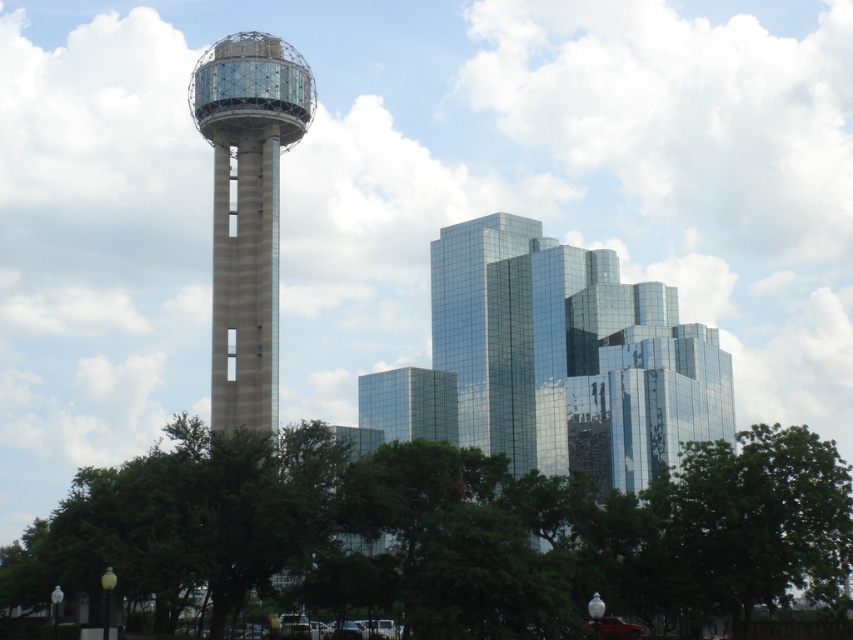
Question: Is green leafy tree at lower center above glassy reflective skyscraper at center?

Choices:
 (A) no
 (B) yes

Answer: (A)

Question: Can you confirm if green leafy tree at lower center is thinner than glassy reflective skyscraper at center?

Choices:
 (A) yes
 (B) no

Answer: (B)

Question: Which object is closer to the camera taking this photo?

Choices:
 (A) green leafy tree at lower center
 (B) glassy reflective skyscraper at center
 (C) concrete glass tower at center

Answer: (A)

Question: Among these points, which one is farthest from the camera?

Choices:
 (A) (265, 204)
 (B) (538, 632)

Answer: (A)

Question: Does green leafy tree at lower center appear on the left side of glassy reflective skyscraper at center?

Choices:
 (A) no
 (B) yes

Answer: (B)

Question: Which point appears farthest from the camera in this image?

Choices:
 (A) (236, 413)
 (B) (782, 456)
 (C) (578, 256)

Answer: (C)